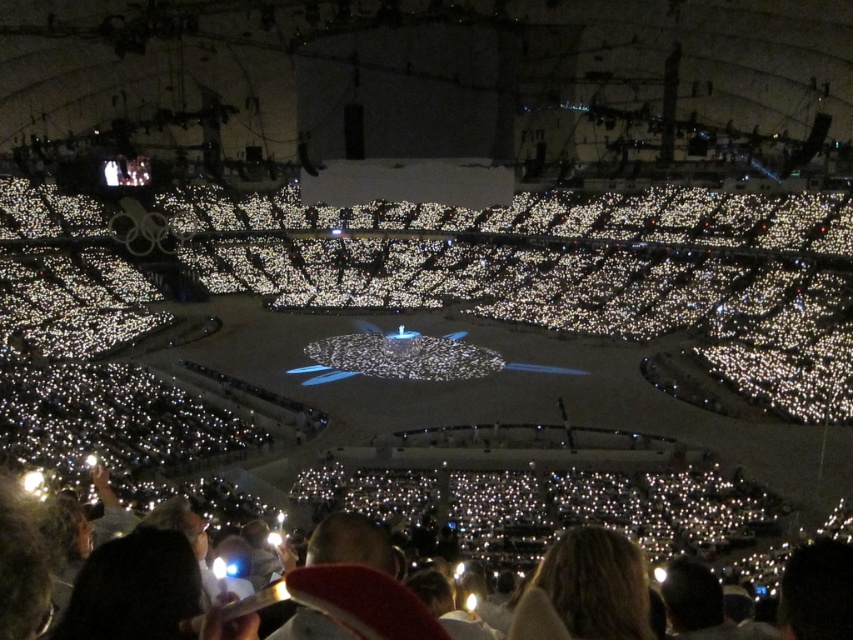
Question: Considering the relative positions of white paper at lower center and blonde hair at lower center in the image provided, where is white paper at lower center located with respect to blonde hair at lower center?

Choices:
 (A) below
 (B) above

Answer: (B)

Question: In this image, where is white paper at lower center located relative to blonde hair at lower center?

Choices:
 (A) above
 (B) below

Answer: (A)

Question: Which object appears farthest from the camera in this image?

Choices:
 (A) white paper at lower center
 (B) blonde hair at lower center

Answer: (A)

Question: Does white paper at lower center appear over blonde hair at lower center?

Choices:
 (A) no
 (B) yes

Answer: (B)

Question: Which point is farther to the camera?

Choices:
 (A) (573, 520)
 (B) (584, 556)

Answer: (A)

Question: Among these points, which one is farthest from the camera?

Choices:
 (A) (741, 536)
 (B) (534, 620)

Answer: (A)